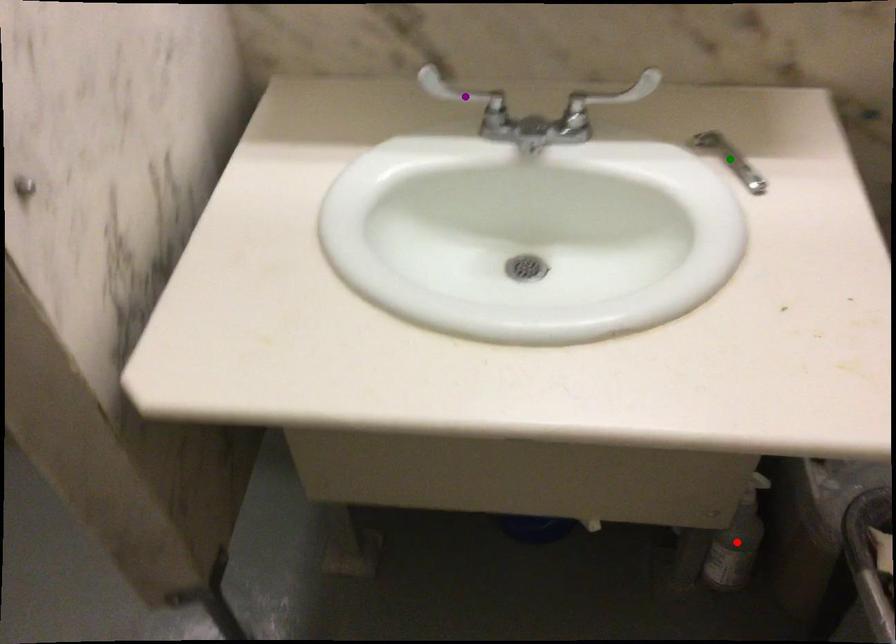
Order these from nearest to farthest:
- green point
- purple point
- red point

1. green point
2. purple point
3. red point